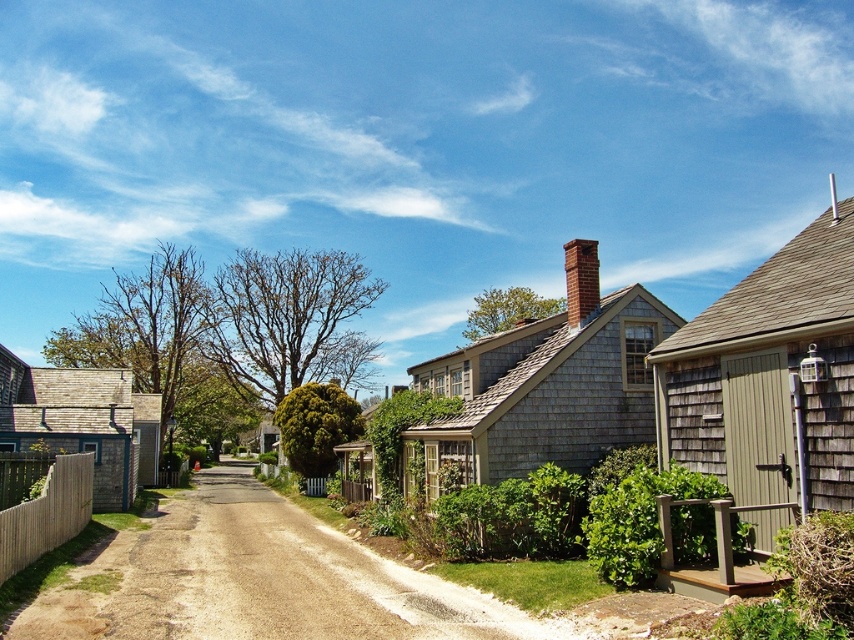
You are standing at the point with coordinates (47, 513) in the suburban street scene. What object can you see directly in front of you?

The wooden picket fence at lower left is located at point (47, 513), so you can see the wooden picket fence at lower left directly in front of you.

You are a painter standing at the corner of the street, looking towards the wooden picket fence at lower left and the brick chimney at upper center. Which object appears taller in the scene?

The wooden picket fence at lower left appears taller than the brick chimney at upper center in the scene.

You are a painter standing at the corner of the street, wanting to paint the wooden picket fence at lower left and the brick chimney at upper center. Which object should you focus on first if you want to paint the larger one first?

The wooden picket fence at lower left has a larger size compared to the brick chimney at upper center, so you should focus on painting the wooden picket fence at lower left first.